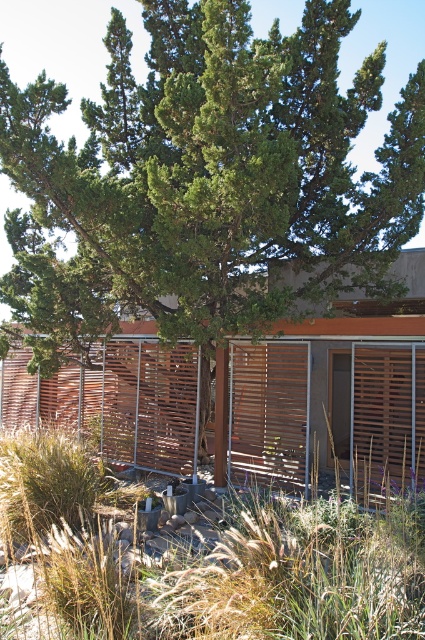
Question: Which point is closer to the camera taking this photo?

Choices:
 (A) (195, 397)
 (B) (252, 544)

Answer: (B)

Question: Can you confirm if dry grass at center is positioned above wooden slats at center?

Choices:
 (A) no
 (B) yes

Answer: (A)

Question: Does dry grass at center have a larger size compared to wooden slats at center?

Choices:
 (A) no
 (B) yes

Answer: (B)

Question: Among these objects, which one is farthest from the camera?

Choices:
 (A) wooden slats at center
 (B) dry grass at center

Answer: (A)

Question: Can you confirm if dry grass at center is bigger than wooden slats at center?

Choices:
 (A) yes
 (B) no

Answer: (A)

Question: Among these points, which one is farthest from the camera?

Choices:
 (A) (280, 442)
 (B) (345, 566)

Answer: (A)